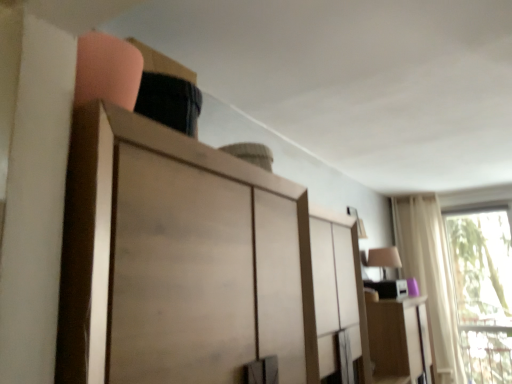
Question: Considering the relative positions of transparent glass window at right and matte wood cabinet at right in the image provided, is transparent glass window at right behind matte wood cabinet at right?

Choices:
 (A) yes
 (B) no

Answer: (A)

Question: From the image's perspective, does transparent glass window at right appear lower than matte wood cabinet at right?

Choices:
 (A) no
 (B) yes

Answer: (A)

Question: Is transparent glass window at right to the left of matte wood cabinet at right from the viewer's perspective?

Choices:
 (A) no
 (B) yes

Answer: (A)

Question: Considering the relative sizes of transparent glass window at right and matte wood cabinet at right in the image provided, is transparent glass window at right smaller than matte wood cabinet at right?

Choices:
 (A) no
 (B) yes

Answer: (B)

Question: Are transparent glass window at right and matte wood cabinet at right far apart?

Choices:
 (A) no
 (B) yes

Answer: (B)

Question: Is matte wood cabinet at right spatially inside white sheer curtain at right, or outside of it?

Choices:
 (A) outside
 (B) inside

Answer: (A)

Question: Looking at the image, does matte wood cabinet at right seem bigger or smaller compared to white sheer curtain at right?

Choices:
 (A) small
 (B) big

Answer: (B)

Question: Is matte wood cabinet at right to the left or to the right of white sheer curtain at right in the image?

Choices:
 (A) right
 (B) left

Answer: (B)

Question: From the image's perspective, is matte wood cabinet at right positioned above or below white sheer curtain at right?

Choices:
 (A) below
 (B) above

Answer: (A)

Question: From a real-world perspective, is transparent glass window at right above or below white sheer curtain at right?

Choices:
 (A) below
 (B) above

Answer: (A)

Question: Considering the relative positions of transparent glass window at right and white sheer curtain at right in the image provided, is transparent glass window at right to the left or to the right of white sheer curtain at right?

Choices:
 (A) left
 (B) right

Answer: (B)

Question: In the image, is transparent glass window at right positioned in front of or behind white sheer curtain at right?

Choices:
 (A) front
 (B) behind

Answer: (A)

Question: In terms of width, does transparent glass window at right look wider or thinner when compared to white sheer curtain at right?

Choices:
 (A) thin
 (B) wide

Answer: (A)

Question: From a real-world perspective, relative to wooden cabinet at upper center, is transparent glass window at right vertically above or below?

Choices:
 (A) above
 (B) below

Answer: (B)

Question: Is transparent glass window at right taller or shorter than wooden cabinet at upper center?

Choices:
 (A) short
 (B) tall

Answer: (B)